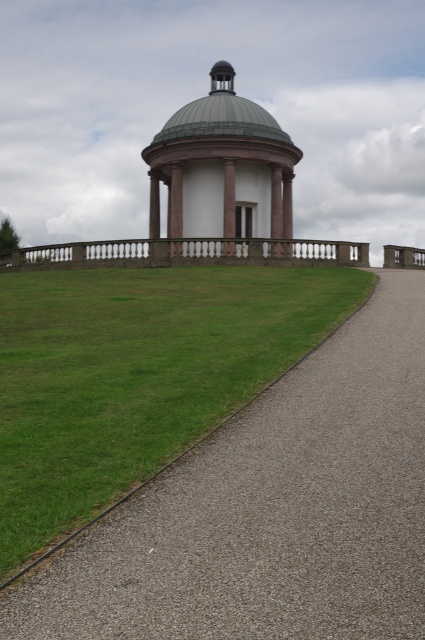
Question: Among these points, which one is farthest from the camera?

Choices:
 (A) click(x=419, y=499)
 (B) click(x=178, y=208)

Answer: (B)

Question: Among these objects, which one is nearest to the camera?

Choices:
 (A) pink marble gazebo at center
 (B) gray gravel driveway at center

Answer: (B)

Question: Can you confirm if gray gravel driveway at center is smaller than pink marble gazebo at center?

Choices:
 (A) yes
 (B) no

Answer: (A)

Question: From the image, what is the correct spatial relationship of gray gravel driveway at center in relation to pink marble gazebo at center?

Choices:
 (A) below
 (B) above

Answer: (A)

Question: Can you confirm if gray gravel driveway at center is positioned to the left of pink marble gazebo at center?

Choices:
 (A) yes
 (B) no

Answer: (B)